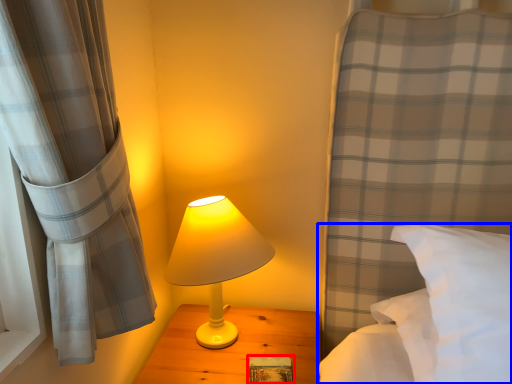
Question: Which object is closer to the camera taking this photo, book (highlighted by a red box) or bed (highlighted by a blue box)?

Choices:
 (A) book
 (B) bed

Answer: (B)